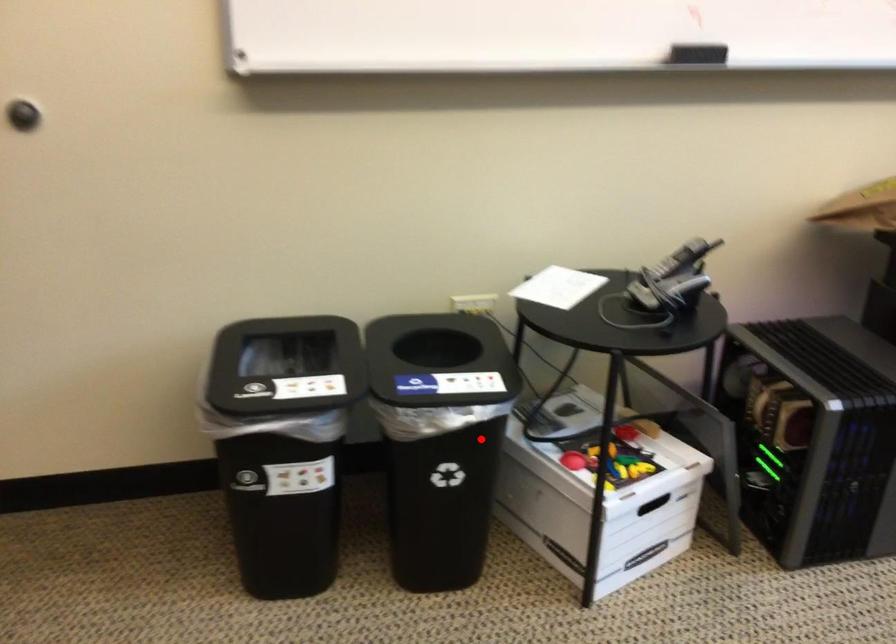
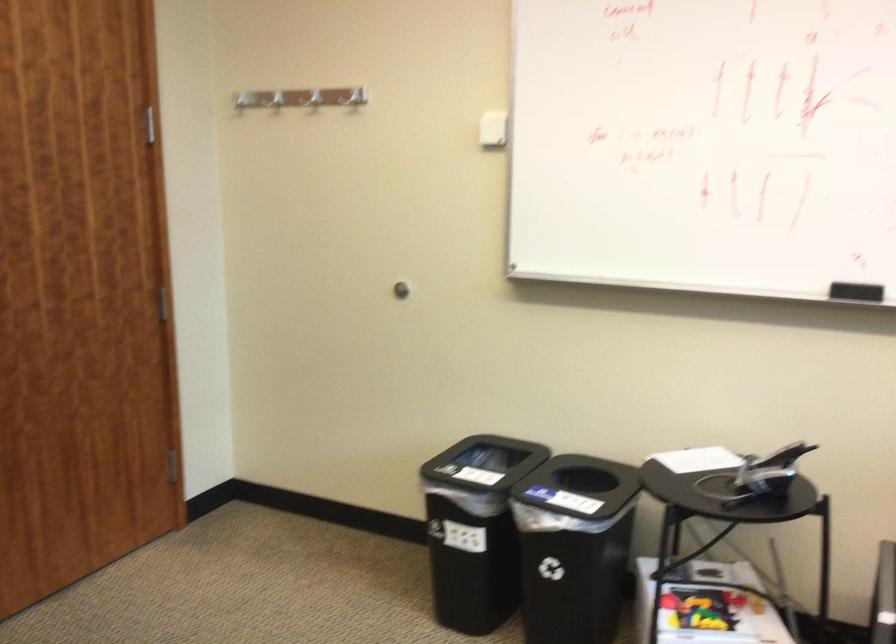
Question: I am providing you with two images of the same scene from different viewpoints. A red point is shown in image1. For the corresponding object point in image2, is it positioned nearer or farther from the camera?

Choices:
 (A) Nearer
 (B) Farther

Answer: (B)